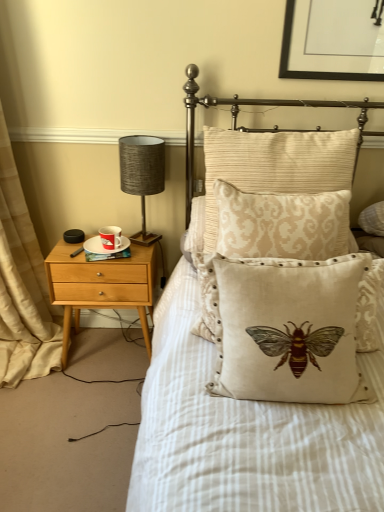
Question: Considering the relative sizes of beige damask pillow at center, which ranks as the 3th pillow in front-to-back order, and textured gray lampshade at left in the image provided, is beige damask pillow at center, which ranks as the 3th pillow in front-to-back order, smaller than textured gray lampshade at left?

Choices:
 (A) yes
 (B) no

Answer: (B)

Question: Can you confirm if beige damask pillow at center, the 1th pillow when ordered from back to front, is wider than textured gray lampshade at left?

Choices:
 (A) yes
 (B) no

Answer: (A)

Question: Can textured gray lampshade at left be found inside beige damask pillow at center, which ranks as the 3th pillow in front-to-back order?

Choices:
 (A) no
 (B) yes

Answer: (A)

Question: Does beige damask pillow at center, which ranks as the 3th pillow in front-to-back order, appear on the right side of textured gray lampshade at left?

Choices:
 (A) no
 (B) yes

Answer: (B)

Question: Considering the relative positions of beige damask pillow at center, the 1th pillow when ordered from back to front, and textured gray lampshade at left in the image provided, is beige damask pillow at center, the 1th pillow when ordered from back to front, to the left of textured gray lampshade at left from the viewer's perspective?

Choices:
 (A) yes
 (B) no

Answer: (B)

Question: Is the depth of beige damask pillow at center, which ranks as the 3th pillow in front-to-back order, less than that of textured gray lampshade at left?

Choices:
 (A) yes
 (B) no

Answer: (A)

Question: Considering the relative positions of white ceramic saucer at left and beige damask pillow at center, the 1th pillow when ordered from back to front, in the image provided, is white ceramic saucer at left to the right of beige damask pillow at center, the 1th pillow when ordered from back to front, from the viewer's perspective?

Choices:
 (A) no
 (B) yes

Answer: (A)

Question: Are white ceramic saucer at left and beige damask pillow at center, which ranks as the 3th pillow in front-to-back order, far apart?

Choices:
 (A) yes
 (B) no

Answer: (B)

Question: Is the depth of white ceramic saucer at left greater than that of beige damask pillow at center, which ranks as the 3th pillow in front-to-back order?

Choices:
 (A) yes
 (B) no

Answer: (A)

Question: Is white ceramic saucer at left with beige damask pillow at center, which ranks as the 3th pillow in front-to-back order?

Choices:
 (A) yes
 (B) no

Answer: (B)

Question: Could beige damask pillow at center, the 1th pillow when ordered from back to front, be considered to be inside white ceramic saucer at left?

Choices:
 (A) no
 (B) yes

Answer: (A)

Question: Is white ceramic saucer at left positioned with its back to beige damask pillow at center, which ranks as the 3th pillow in front-to-back order?

Choices:
 (A) no
 (B) yes

Answer: (A)

Question: Are beige damask pillow at center, which ranks as the 3th pillow in front-to-back order, and white ceramic saucer at left making contact?

Choices:
 (A) no
 (B) yes

Answer: (A)